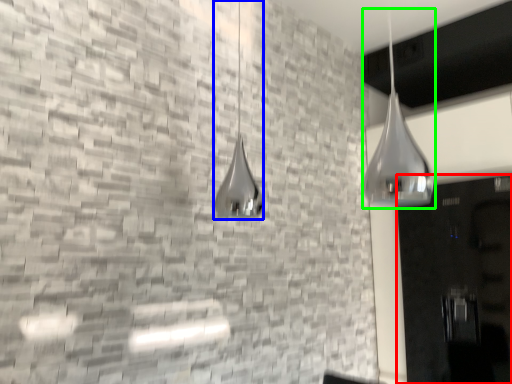
Question: Which object is the closest to the door (highlighted by a red box)? Choose among these: shower (highlighted by a blue box) or shower (highlighted by a green box).

Choices:
 (A) shower
 (B) shower

Answer: (B)